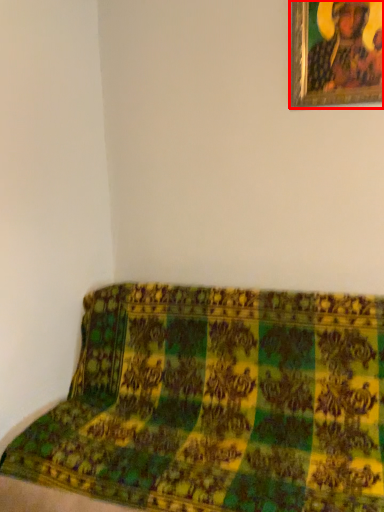
Question: In this image, where is picture frame (annotated by the red box) located relative to furniture?

Choices:
 (A) right
 (B) left

Answer: (A)